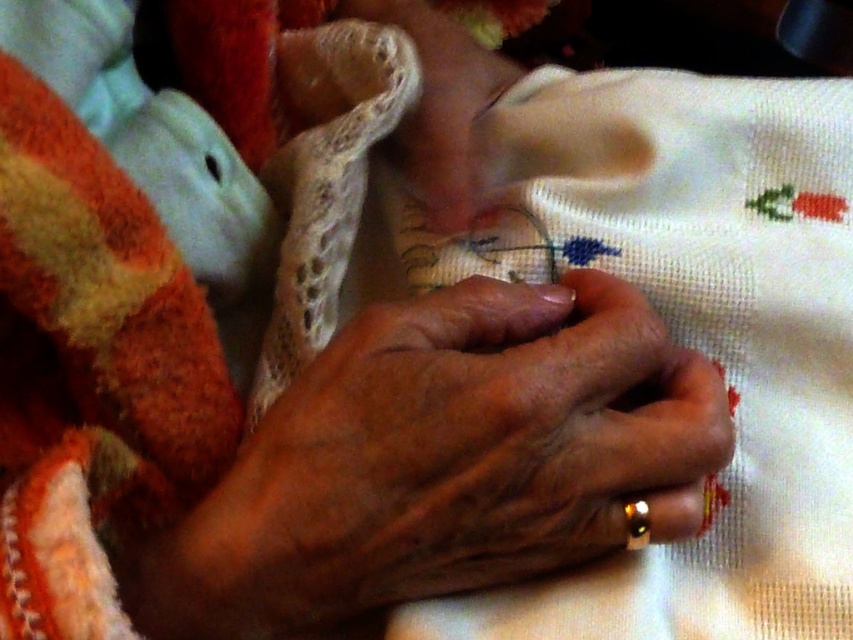
Does smooth skin hands at center appear under smooth beige hand at center?

Yes, smooth skin hands at center is below smooth beige hand at center.

Who is shorter, smooth skin hands at center or smooth beige hand at center?

smooth skin hands at center is shorter.

Between point (148, 572) and point (444, 33), which one is positioned in front?

Point (148, 572) is in front.

This screenshot has width=853, height=640. In order to click on smooth skin hands at center in this screenshot , I will do `click(445, 460)`.